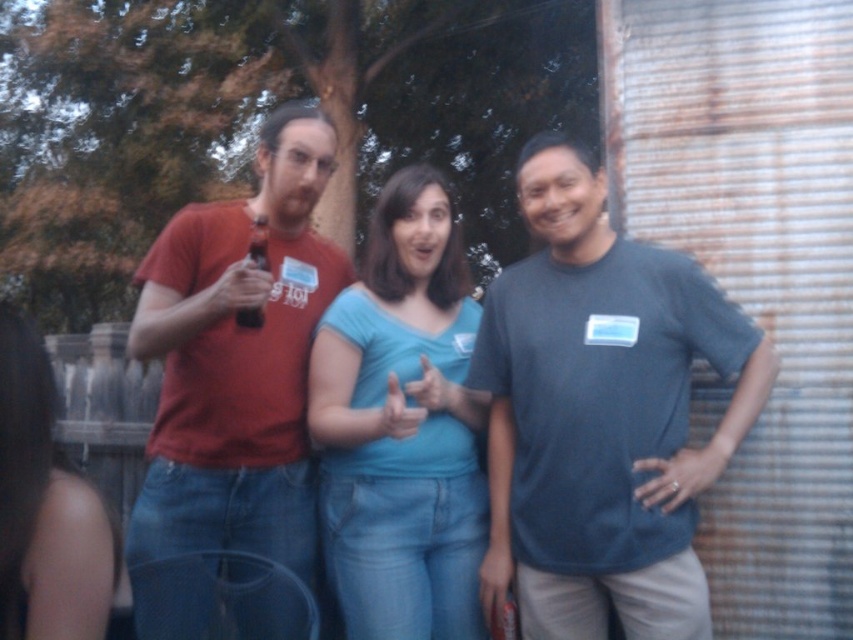
Locate an element on the screen. dark gray t-shirt at center is located at coordinates (601, 413).

Locate an element on the screen. dark gray t-shirt at center is located at coordinates (601, 413).

How far apart are dark gray t-shirt at center and matte red shirt at left?

They are 33.83 inches apart.

Which is behind, point (483, 600) or point (286, 374)?

The point (286, 374) is behind.

Describe the element at coordinates (601, 413) in the screenshot. I see `dark gray t-shirt at center` at that location.

Where is `dark gray t-shirt at center`? Image resolution: width=853 pixels, height=640 pixels. dark gray t-shirt at center is located at coordinates (601, 413).

Can you confirm if blue cotton shirt at center is positioned to the right of matte plastic bottle at center?

Indeed, blue cotton shirt at center is positioned on the right side of matte plastic bottle at center.

This screenshot has height=640, width=853. Describe the element at coordinates (402, 426) in the screenshot. I see `blue cotton shirt at center` at that location.

Where is `blue cotton shirt at center`? The image size is (853, 640). blue cotton shirt at center is located at coordinates (402, 426).